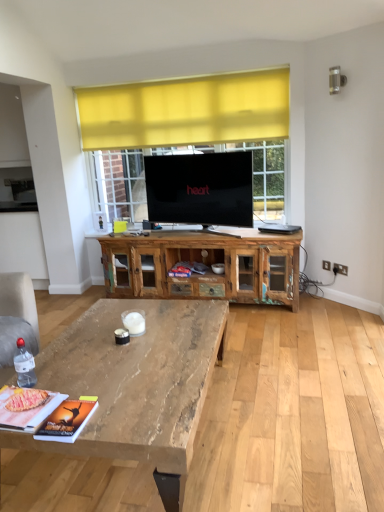
Describe the element at coordinates (205, 264) in the screenshot. I see `rustic wood cabinet at center` at that location.

Locate an element on the screen. Image resolution: width=384 pixels, height=512 pixels. rustic wood cabinet at center is located at coordinates (205, 264).

The width and height of the screenshot is (384, 512). Describe the element at coordinates (136, 382) in the screenshot. I see `natural wood coffee table at lower left` at that location.

In order to click on natural wood coffee table at lower left in this screenshot , I will do `click(136, 382)`.

The width and height of the screenshot is (384, 512). Find the location of `rustic wood cabinet at center`. rustic wood cabinet at center is located at coordinates (205, 264).

Is rustic wood cabinet at center to the left of natural wood coffee table at lower left from the viewer's perspective?

No.

Is rustic wood cabinet at center further to the viewer compared to natural wood coffee table at lower left?

Yes, rustic wood cabinet at center is further from the viewer.

Which is in front, point (138, 287) or point (114, 435)?

The point (114, 435) is in front.

From the image's perspective, relative to natural wood coffee table at lower left, is rustic wood cabinet at center above or below?

Clearly, from the image's perspective, rustic wood cabinet at center is above natural wood coffee table at lower left.

From a real-world perspective, is rustic wood cabinet at center positioned above or below natural wood coffee table at lower left?

In terms of real-world spatial position, rustic wood cabinet at center is above natural wood coffee table at lower left.

Is rustic wood cabinet at center thinner than natural wood coffee table at lower left?

Indeed, rustic wood cabinet at center has a lesser width compared to natural wood coffee table at lower left.

Who is taller, rustic wood cabinet at center or natural wood coffee table at lower left?

With more height is rustic wood cabinet at center.

Who is smaller, rustic wood cabinet at center or natural wood coffee table at lower left?

rustic wood cabinet at center.

Would you say natural wood coffee table at lower left is part of rustic wood cabinet at center's contents?

No, natural wood coffee table at lower left is not surrounded by rustic wood cabinet at center.

Is rustic wood cabinet at center next to natural wood coffee table at lower left?

No, rustic wood cabinet at center is not in contact with natural wood coffee table at lower left.

Is rustic wood cabinet at center aimed at natural wood coffee table at lower left?

Yes, rustic wood cabinet at center is oriented towards natural wood coffee table at lower left.

Based on the photo, can you tell me how much rustic wood cabinet at center and natural wood coffee table at lower left differ in facing direction?

They differ by 87.7 degrees in their facing directions.

How far apart are rustic wood cabinet at center and natural wood coffee table at lower left?

A distance of 1.32 meters exists between rustic wood cabinet at center and natural wood coffee table at lower left.

Where is `cabinetry on the right of natural wood coffee table at lower left`? This screenshot has height=512, width=384. cabinetry on the right of natural wood coffee table at lower left is located at coordinates (205, 264).

Is natural wood coffee table at lower left to the left of rustic wood cabinet at center from the viewer's perspective?

Indeed, natural wood coffee table at lower left is positioned on the left side of rustic wood cabinet at center.

Based on the photo, considering the relative positions of natural wood coffee table at lower left and rustic wood cabinet at center in the image provided, is natural wood coffee table at lower left behind rustic wood cabinet at center?

No, it is not.

Which point is more distant from viewer, [55,374] or [125,256]?

The point [125,256] is behind.

From the image's perspective, is natural wood coffee table at lower left located above or below rustic wood cabinet at center?

natural wood coffee table at lower left is situated lower than rustic wood cabinet at center in the image.

From a real-world perspective, is natural wood coffee table at lower left located higher than rustic wood cabinet at center?

No, from a real-world perspective, natural wood coffee table at lower left is not on top of rustic wood cabinet at center.

Does natural wood coffee table at lower left have a lesser width compared to rustic wood cabinet at center?

No, natural wood coffee table at lower left is not thinner than rustic wood cabinet at center.

Considering the sizes of objects natural wood coffee table at lower left and rustic wood cabinet at center in the image provided, who is taller, natural wood coffee table at lower left or rustic wood cabinet at center?

rustic wood cabinet at center is taller.

In terms of size, does natural wood coffee table at lower left appear bigger or smaller than rustic wood cabinet at center?

In the image, natural wood coffee table at lower left appears to be larger than rustic wood cabinet at center.

Do you think natural wood coffee table at lower left is within rustic wood cabinet at center, or outside of it?

natural wood coffee table at lower left exists outside the volume of rustic wood cabinet at center.

Based on the photo, are natural wood coffee table at lower left and rustic wood cabinet at center making contact?

No.

Is natural wood coffee table at lower left positioned with its back to rustic wood cabinet at center?

No, natural wood coffee table at lower left is not facing away from rustic wood cabinet at center.

Can you tell me how much natural wood coffee table at lower left and rustic wood cabinet at center differ in facing direction?

They differ by 87.7 degrees in their facing directions.

What are the coordinates of `coffee table below the rustic wood cabinet at center (from a real-world perspective)` in the screenshot? It's located at (136, 382).

The width and height of the screenshot is (384, 512). In order to click on cabinetry above the natural wood coffee table at lower left (from the image's perspective) in this screenshot , I will do `click(205, 264)`.

Identify the location of cabinetry behind the natural wood coffee table at lower left. This screenshot has height=512, width=384. (205, 264).